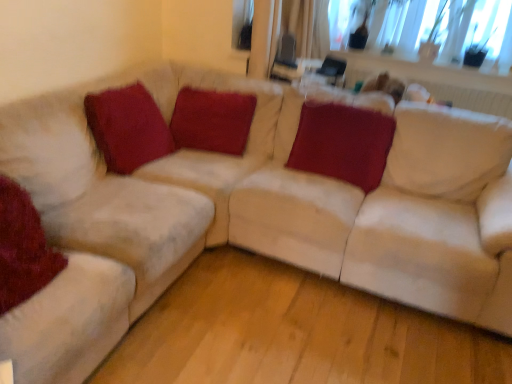
Question: From the image's perspective, relative to satin red pillow at center, which appears as the 4th pillow when viewed from the left, is velvet red pillow at upper left, the 2th pillow positioned from the left, above or below?

Choices:
 (A) below
 (B) above

Answer: (B)

Question: Relative to satin red pillow at center, which is counted as the 1th pillow, starting from the right, is velvet red pillow at upper left, the third pillow viewed from the right, in front or behind?

Choices:
 (A) front
 (B) behind

Answer: (A)

Question: Estimate the real-world distances between objects in this image. Which object is closer to the velvet red pillow at upper left, the 2th pillow positioned from the left?

Choices:
 (A) velvet red pillow at lower left, acting as the 4th pillow starting from the right
 (B) velvet red pillow at center, which is counted as the 3th pillow, starting from the left
 (C) satin red pillow at center, which is counted as the 1th pillow, starting from the right

Answer: (B)

Question: Which object is positioned closest to the velvet red pillow at center, which is counted as the 3th pillow, starting from the left?

Choices:
 (A) satin red pillow at center, which appears as the 4th pillow when viewed from the left
 (B) velvet red pillow at upper left, the third pillow viewed from the right
 (C) velvet red pillow at lower left, acting as the 4th pillow starting from the right

Answer: (B)